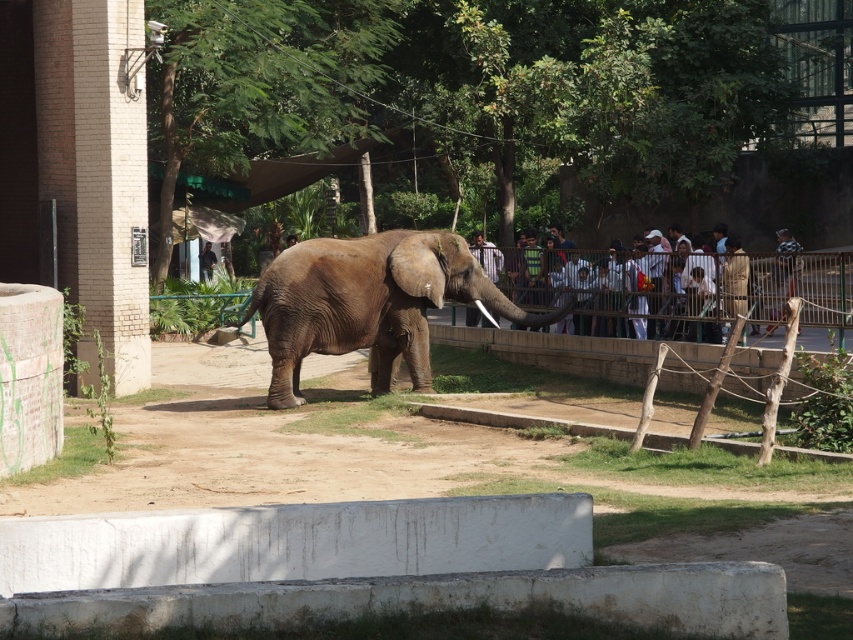
Question: Considering the relative positions of brown textured elephant at center and light brown fabric shirt at center in the image provided, where is brown textured elephant at center located with respect to light brown fabric shirt at center?

Choices:
 (A) right
 (B) left

Answer: (B)

Question: Which of these objects is positioned farthest from the dark brown leather jacket at center?

Choices:
 (A) brown textured elephant at center
 (B) light brown fabric shirt at center

Answer: (A)

Question: Which object appears closest to the camera in this image?

Choices:
 (A) brown textured elephant at center
 (B) light brown fabric shirt at center

Answer: (B)

Question: Can you confirm if light brown fabric shirt at center is wider than dark brown leather jacket at center?

Choices:
 (A) yes
 (B) no

Answer: (A)

Question: Which point is farther to the camera?

Choices:
 (A) (354, 324)
 (B) (646, 291)

Answer: (B)

Question: Is brown textured elephant at center positioned in front of dark brown leather jacket at center?

Choices:
 (A) no
 (B) yes

Answer: (B)